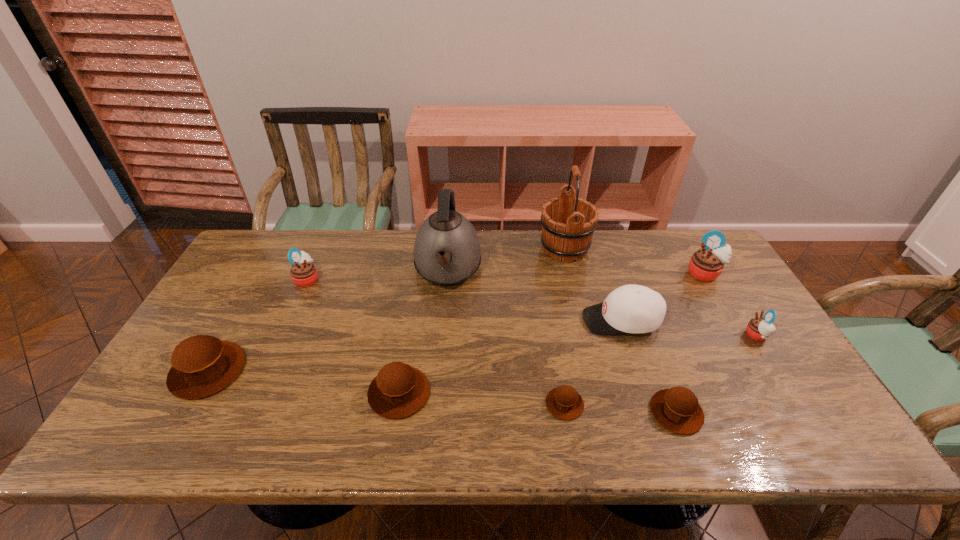
This screenshot has width=960, height=540. I want to click on free spot located 0.230m on the front-facing side of the white baseball cap, so click(501, 320).

Locate an element on the screen. blank area located 0.080m on the front-facing side of the white baseball cap is located at coordinates (554, 320).

This screenshot has width=960, height=540. What are the coordinates of `vacant space located 0.330m on the front-facing side of the white baseball cap` in the screenshot? It's located at (467, 320).

Where is `vacant space positioned on the front of the leftmost object`? This screenshot has width=960, height=540. vacant space positioned on the front of the leftmost object is located at coordinates (176, 428).

Identify the location of free space located 0.080m on the front-facing side of the nearest pink muffin. This screenshot has width=960, height=540. (716, 336).

At what (x,y) coordinates should I click in order to perform the action: click on vacant space located 0.130m on the front-facing side of the nearest pink muffin. Please return your answer as a coordinate pair (x, y). The height and width of the screenshot is (540, 960). Looking at the image, I should click on (698, 336).

The height and width of the screenshot is (540, 960). I want to click on blank space located 0.390m on the front-facing side of the nearest pink muffin, so click(x=603, y=336).

Locate an element on the screen. The image size is (960, 540). vacant area situated on the back of the third muffin from left to right is located at coordinates (416, 293).

You are a GUI agent. You are given a task and a screenshot of the screen. Output one action in this format:
    pyautogui.click(x=<x>, y=<y>)
    Task: Click on the free location located 0.110m on the left of the second shortest object
    This screenshot has height=540, width=960.
    Given the screenshot: What is the action you would take?
    pyautogui.click(x=603, y=413)

Identify the location of free space located on the right of the smallest brown muffin. (688, 404).